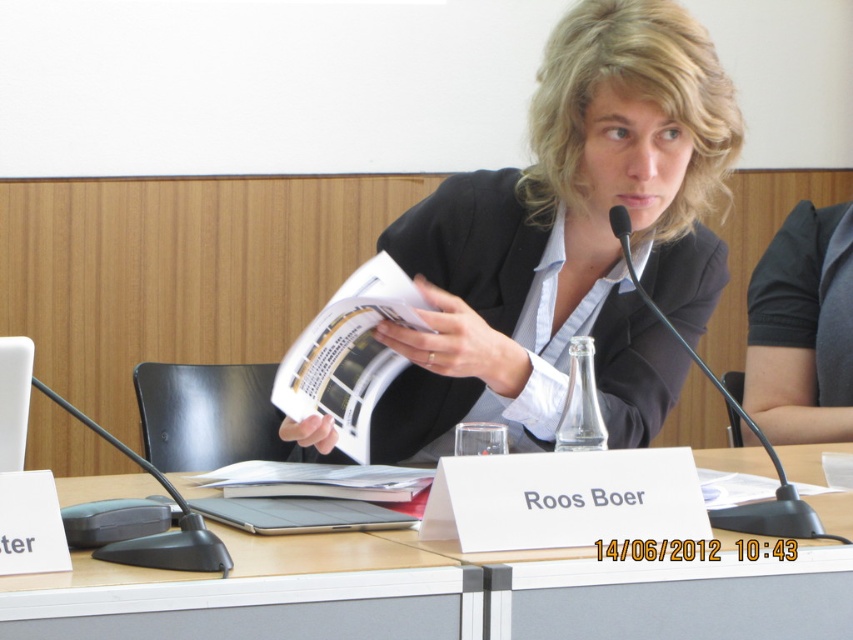
Is point (631, 125) positioned behind point (100, 548)?

Yes, it is.

Who is more distant from viewer, [663,278] or [155,557]?

Positioned behind is point [663,278].

Is point (670, 264) closer to viewer compared to point (177, 560)?

No.

The image size is (853, 640). In order to click on matte black suit at center in this screenshot , I will do `click(570, 243)`.

Consider the image. Which is above, black plastic microphone at center or white plastic laptop at left?

black plastic microphone at center

Is point (618, 209) less distant than point (0, 420)?

That is False.

Locate an element on the screen. black plastic microphone at center is located at coordinates pos(746,424).

Does dark gray fabric at right have a greater width compared to black plastic microphone at center?

Indeed, dark gray fabric at right has a greater width compared to black plastic microphone at center.

Is point (776, 257) less distant than point (662, 321)?

No, it is behind (662, 321).

In order to click on dark gray fabric at right in this screenshot , I will do `click(802, 330)`.